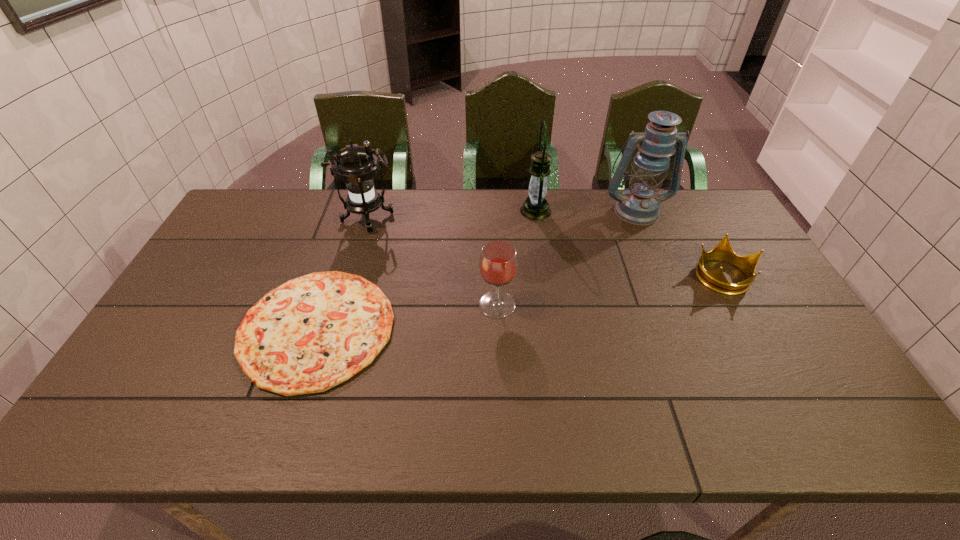
Locate an element on the screen. This screenshot has height=540, width=960. free point between the fourth tallest object and the crown is located at coordinates (610, 290).

At what (x,y) coordinates should I click in order to perform the action: click on unoccupied area between the second lantern from right to left and the leftmost lantern. Please return your answer as a coordinate pair (x, y). Looking at the image, I should click on (452, 215).

What are the coordinates of `free space between the rightmost lantern and the crown` in the screenshot? It's located at (680, 243).

Where is `unoccupied position between the rightmost lantern and the fourth tallest object`? unoccupied position between the rightmost lantern and the fourth tallest object is located at coordinates (566, 258).

The height and width of the screenshot is (540, 960). In order to click on free space between the leftmost lantern and the third shortest object in this screenshot , I will do `click(433, 261)`.

This screenshot has height=540, width=960. Identify the location of empty location between the leftmost lantern and the fifth tallest object. (545, 247).

I want to click on empty space between the pizza and the rightmost lantern, so click(476, 269).

The height and width of the screenshot is (540, 960). I want to click on empty space that is in between the wineglass and the shortest object, so click(x=407, y=316).

Image resolution: width=960 pixels, height=540 pixels. Find the location of `empty space between the crown and the shortest object`. empty space between the crown and the shortest object is located at coordinates (520, 302).

Locate an element on the screen. object that can be found as the closest to the fourth object from left to right is located at coordinates (x=639, y=205).